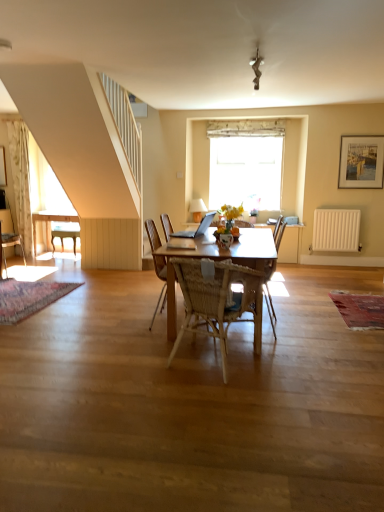
Question: From a real-world perspective, is woven wood chair at center, the third chair positioned from the back, under wooden framed painting at upper right?

Choices:
 (A) yes
 (B) no

Answer: (A)

Question: Does woven wood chair at center, acting as the third chair starting from the left, have a smaller size compared to wooden framed painting at upper right?

Choices:
 (A) no
 (B) yes

Answer: (A)

Question: From a real-world perspective, is woven wood chair at center, acting as the third chair starting from the left, on top of wooden framed painting at upper right?

Choices:
 (A) no
 (B) yes

Answer: (A)

Question: Is there a large distance between woven wood chair at center, acting as the third chair starting from the left, and wooden framed painting at upper right?

Choices:
 (A) yes
 (B) no

Answer: (A)

Question: Is the position of woven wood chair at center, the first chair from the right, less distant than that of wooden framed painting at upper right?

Choices:
 (A) yes
 (B) no

Answer: (A)

Question: Which is correct: white floral fabric curtain at left is inside woven wood armchair at center, or outside of it?

Choices:
 (A) inside
 (B) outside

Answer: (B)

Question: Relative to woven wood armchair at center, is white floral fabric curtain at left in front or behind?

Choices:
 (A) behind
 (B) front

Answer: (A)

Question: Looking at their shapes, would you say white floral fabric curtain at left is wider or thinner than woven wood armchair at center?

Choices:
 (A) wide
 (B) thin

Answer: (B)

Question: From a real-world perspective, is white floral fabric curtain at left above or below woven wood armchair at center?

Choices:
 (A) above
 (B) below

Answer: (A)

Question: Is wooden chair at left, which is the 2th chair from right to left, spatially inside silver metallic laptop at center, or outside of it?

Choices:
 (A) inside
 (B) outside

Answer: (B)

Question: Considering the positions of wooden chair at left, which is the 2th chair from right to left, and silver metallic laptop at center in the image, is wooden chair at left, which is the 2th chair from right to left, taller or shorter than silver metallic laptop at center?

Choices:
 (A) tall
 (B) short

Answer: (A)

Question: Considering the positions of point (66, 223) and point (180, 236), is point (66, 223) closer or farther from the camera than point (180, 236)?

Choices:
 (A) farther
 (B) closer

Answer: (A)

Question: Considering the relative positions of wooden chair at left, the 2th chair in the left-to-right sequence, and silver metallic laptop at center in the image provided, is wooden chair at left, the 2th chair in the left-to-right sequence, to the left or to the right of silver metallic laptop at center?

Choices:
 (A) left
 (B) right

Answer: (A)

Question: Considering the positions of translucent glass vase at center and wooden desk at left in the image, is translucent glass vase at center bigger or smaller than wooden desk at left?

Choices:
 (A) small
 (B) big

Answer: (A)

Question: Visually, is translucent glass vase at center positioned to the left or to the right of wooden desk at left?

Choices:
 (A) left
 (B) right

Answer: (B)